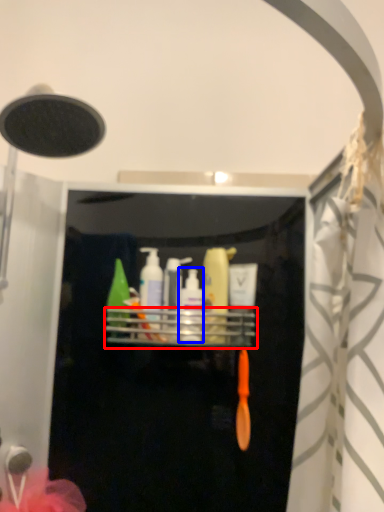
Question: Which object is closer to the camera taking this photo, shelf (highlighted by a red box) or toiletry (highlighted by a blue box)?

Choices:
 (A) shelf
 (B) toiletry

Answer: (A)